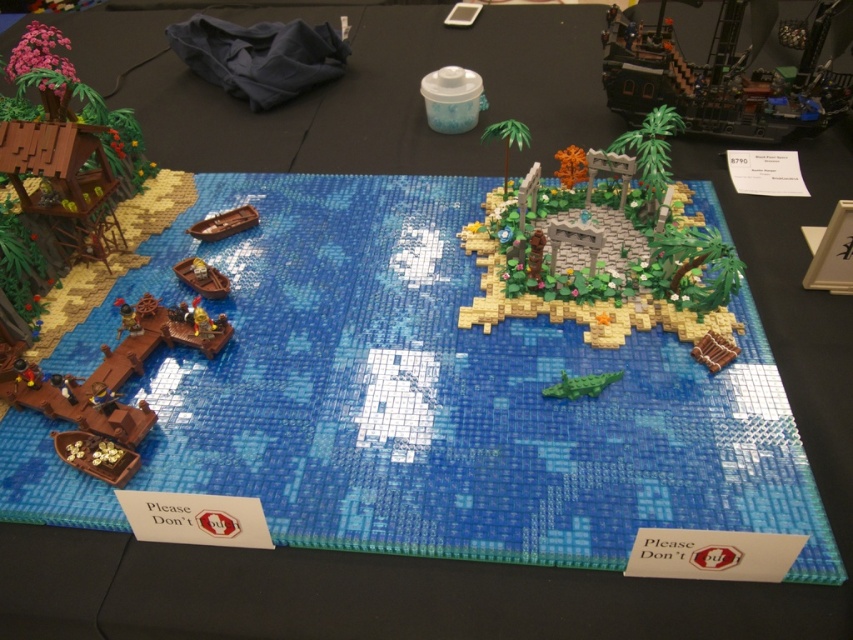
You are a LEGO figure standing on the dock. You want to reach the dark brown wooden pirate ship at upper right but there is a blue mosaic tile at center in your path. Can you walk around it? Explain why or why not based on their positions.

The blue mosaic tile at center is in front of the dark brown wooden pirate ship at upper right. This means the blue mosaic tile is blocking the direct path to the ship. Since the tile is positioned between you and the ship, you would need to walk around it to reach the pirate ship.

You are a LEGO architect designing a new tropical island scene. You want to place a decorative blue mosaic tile at center in your design. According to the provided coordinates, where should you position it in terms of the island baseplate?

The blue mosaic tile at center should be positioned at the coordinates point (442, 394) on the island baseplate.